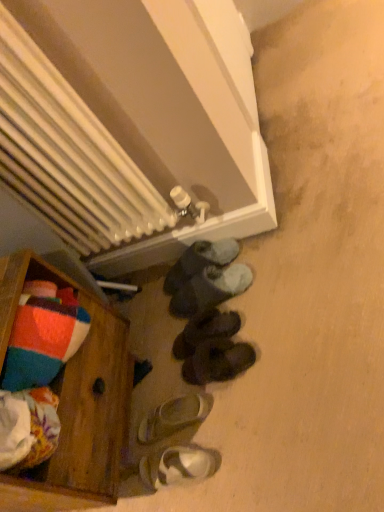
Find the location of a particular element. The height and width of the screenshot is (512, 384). vacant space that's between black suede slippers at center, which is counted as the third footwear, starting from the top, and dark gray suede slippers at lower center, which is the 5th footwear from bottom to top is located at coordinates (226, 311).